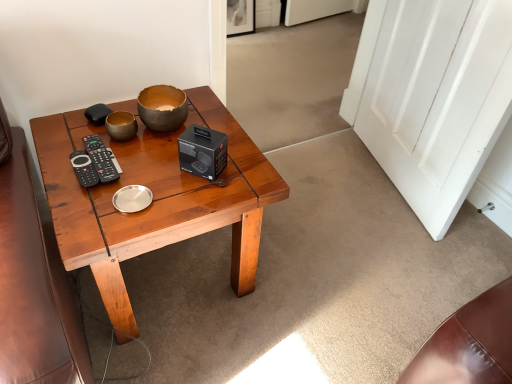
The width and height of the screenshot is (512, 384). Identify the location of free space in front of black plastic remote at left. (81, 214).